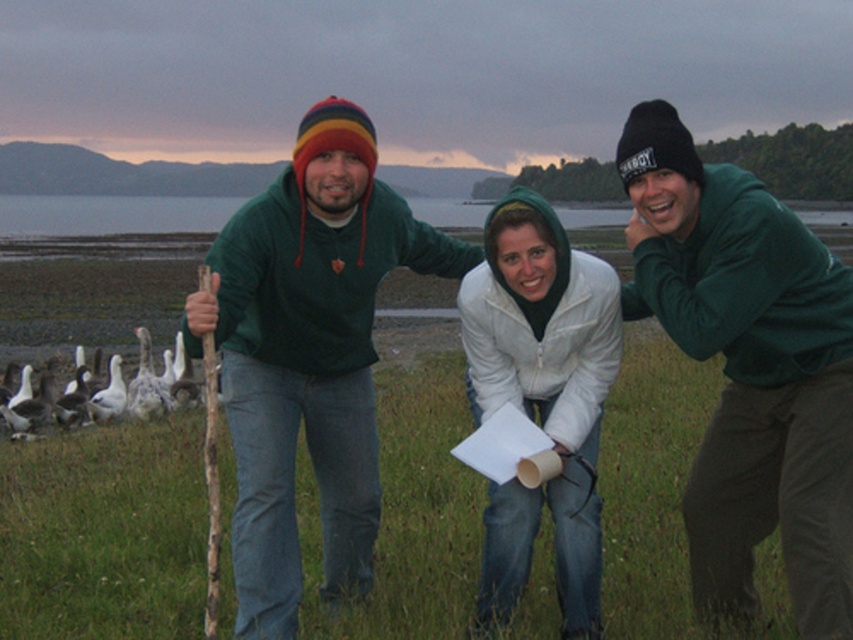
Question: Does green fleece jacket at center have a greater width compared to white down feathers at lower left?

Choices:
 (A) no
 (B) yes

Answer: (A)

Question: Can you confirm if green woolen sweater at center is positioned to the right of white down feathers at lower left?

Choices:
 (A) yes
 (B) no

Answer: (A)

Question: Does green woolen sweater at center come in front of white fleece jacket at center?

Choices:
 (A) yes
 (B) no

Answer: (A)

Question: Which point is farther to the camera?

Choices:
 (A) matte green hoodie at center
 (B) green fleece jacket at center
 (C) green woolen sweater at center
 (D) white fleece jacket at center

Answer: (D)

Question: Which object is positioned farthest from the white down feathers at lower left?

Choices:
 (A) white fleece jacket at center
 (B) green woolen sweater at center

Answer: (B)

Question: Which point appears farthest from the camera in this image?

Choices:
 (A) (730, 392)
 (B) (360, 452)

Answer: (B)